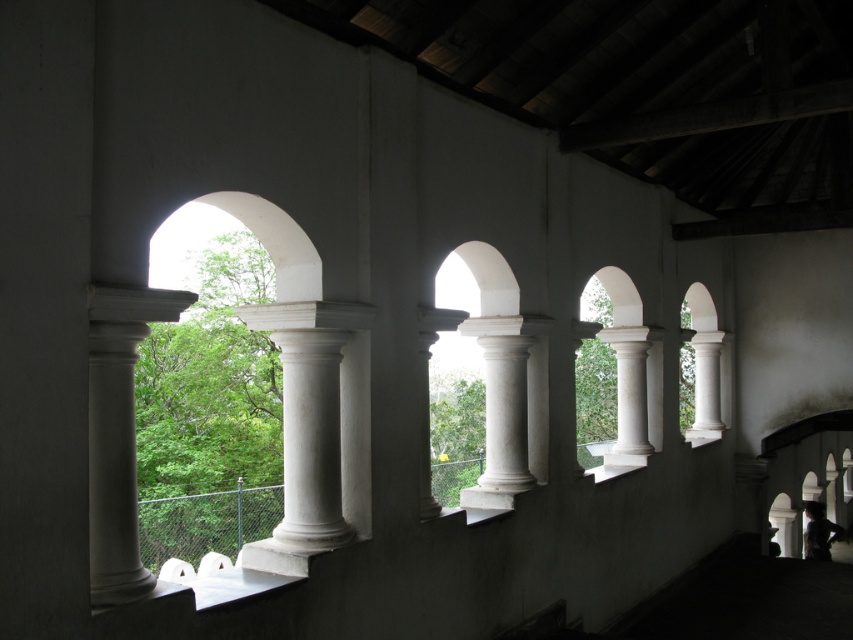
Who is taller, white marble column at left or white marble column at center?

white marble column at center

Who is lower down, white marble column at left or white marble column at center?

Positioned lower is white marble column at center.

The image size is (853, 640). In order to click on white marble column at left in this screenshot , I will do `click(117, 433)`.